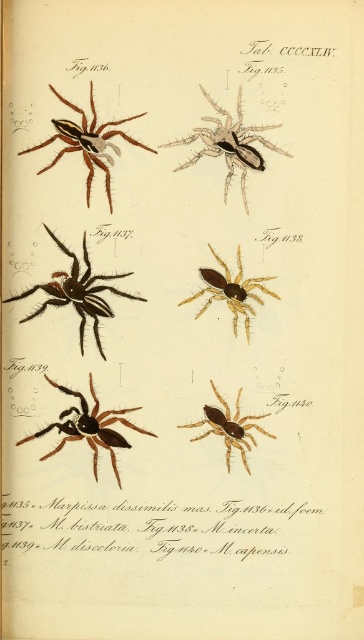
Question: Can you confirm if golden metallic spider at center is positioned below brown fuzzy spider at center?

Choices:
 (A) no
 (B) yes

Answer: (A)

Question: Which object is positioned farthest from the shiny brown spider at upper left?

Choices:
 (A) black glossy spider at upper center
 (B) shiny black spider at center
 (C) shiny brown spider at center
 (D) golden metallic spider at center

Answer: (C)

Question: Which point appears farthest from the camera in this image?

Choices:
 (A) (242, 440)
 (B) (112, 413)

Answer: (B)

Question: Is golden metallic spider at center above brown fuzzy spider at center?

Choices:
 (A) no
 (B) yes

Answer: (B)

Question: Is the position of shiny brown spider at upper left more distant than that of golden metallic spider at center?

Choices:
 (A) yes
 (B) no

Answer: (B)

Question: Which object is positioned closest to the golden metallic spider at center?

Choices:
 (A) shiny brown spider at center
 (B) shiny black spider at center
 (C) black glossy spider at upper center

Answer: (B)